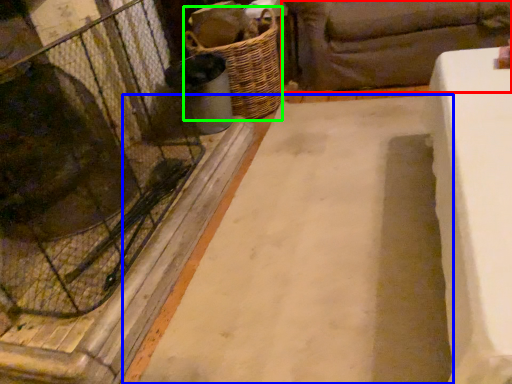
Question: Which object is the closest to the studio couch (highlighted by a red box)? Choose among these: foundation (highlighted by a blue box) or basket (highlighted by a green box).

Choices:
 (A) foundation
 (B) basket

Answer: (B)